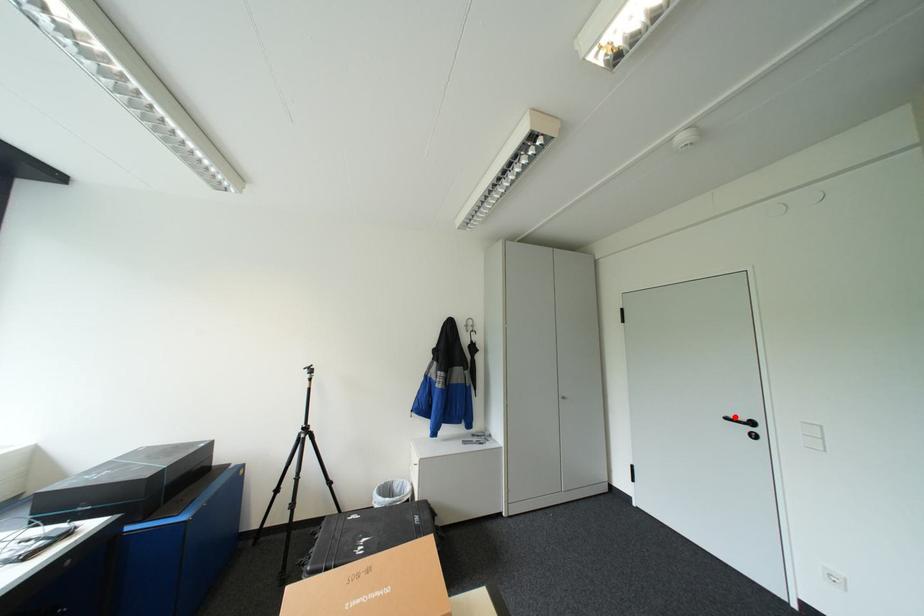
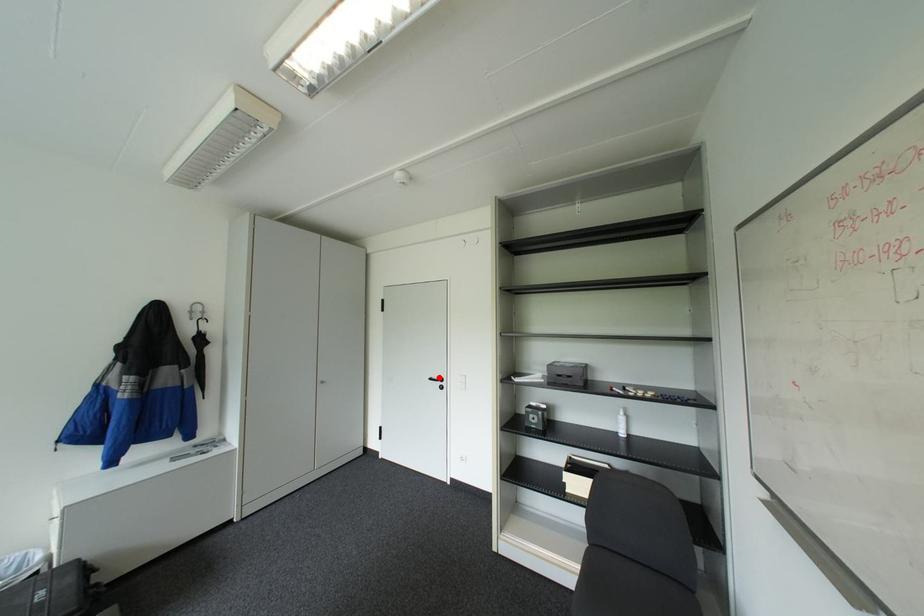
I am providing you with two images of the same scene from different viewpoints. A red point is marked on the first image and another point is marked on the second image. Do the highlighted points in image1 and image2 indicate the same real-world spot?

Yes